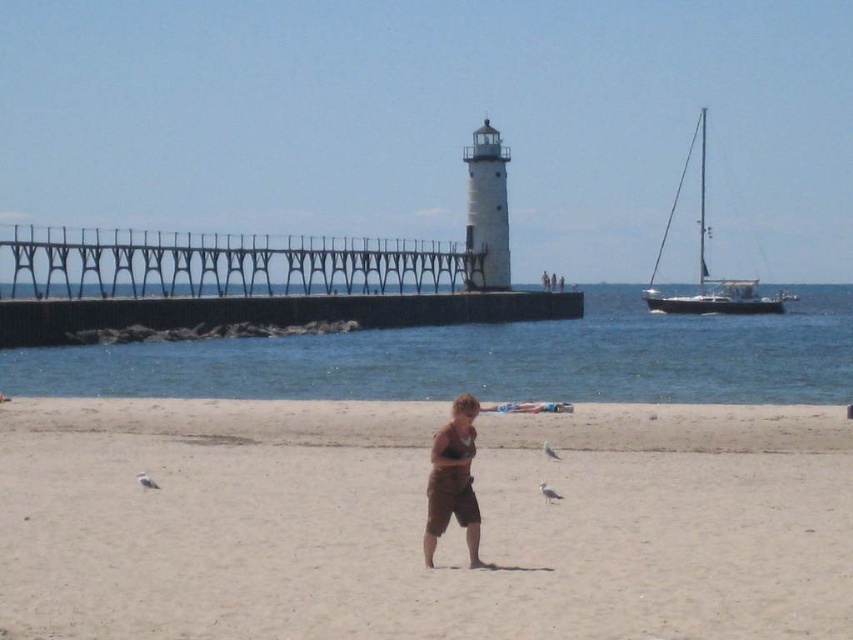
Question: Where is dark gray concrete pier at center located in relation to brown cotton shorts at center in the image?

Choices:
 (A) right
 (B) left

Answer: (B)

Question: Which of the following is the closest to the observer?

Choices:
 (A) (482, 291)
 (B) (439, 465)
 (C) (700, 163)

Answer: (B)

Question: Can you confirm if light brown sand at center is positioned below dark gray concrete pier at center?

Choices:
 (A) yes
 (B) no

Answer: (A)

Question: Where is blue water at center located in relation to dark gray concrete pier at center in the image?

Choices:
 (A) below
 (B) above

Answer: (A)

Question: Estimate the real-world distances between objects in this image. Which object is farther from the blue water at center?

Choices:
 (A) white sailboat at right
 (B) brown cotton shorts at center
 (C) light brown sand at center

Answer: (B)

Question: Among these points, which one is nearest to the camera?

Choices:
 (A) (480, 337)
 (B) (694, 292)
 (C) (782, 561)

Answer: (C)